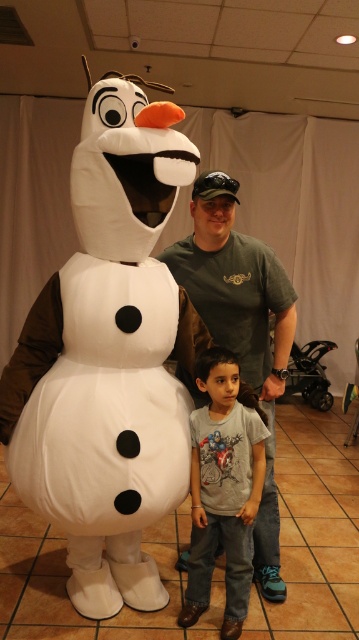
Question: Which object is the closest to the gray cotton shirt at center?

Choices:
 (A) green cotton t-shirt at center
 (B) white plush snowman at center

Answer: (A)

Question: Among these points, which one is nearest to the camera?

Choices:
 (A) (207, 376)
 (B) (91, 204)
 (C) (273, 550)

Answer: (B)

Question: Does white plush snowman at center have a smaller size compared to green cotton t-shirt at center?

Choices:
 (A) yes
 (B) no

Answer: (B)

Question: Does white plush snowman at center appear under gray cotton shirt at center?

Choices:
 (A) no
 (B) yes

Answer: (A)

Question: Among these objects, which one is nearest to the camera?

Choices:
 (A) white plush snowman at center
 (B) gray cotton shirt at center

Answer: (A)

Question: Does white plush snowman at center have a lesser width compared to green cotton t-shirt at center?

Choices:
 (A) no
 (B) yes

Answer: (A)